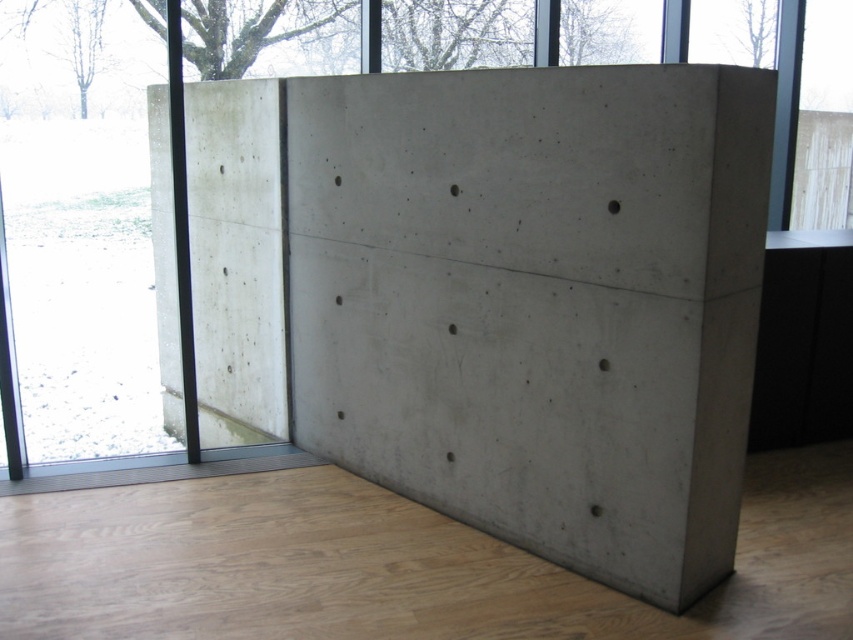
Which is behind, point (560, 465) or point (144, 413)?

The point (144, 413) is behind.

Where is `gray concrete wall at center`? The width and height of the screenshot is (853, 640). gray concrete wall at center is located at coordinates (537, 301).